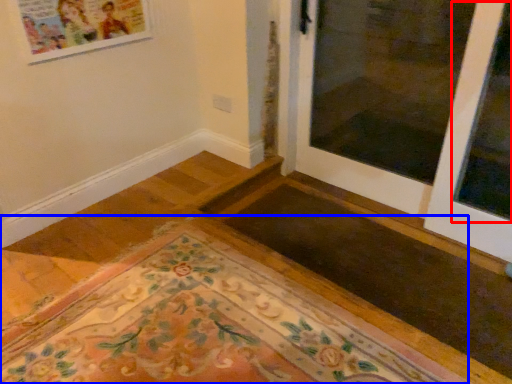
Question: Which object is further to the camera taking this photo, window (highlighted by a red box) or mat (highlighted by a blue box)?

Choices:
 (A) window
 (B) mat

Answer: (A)